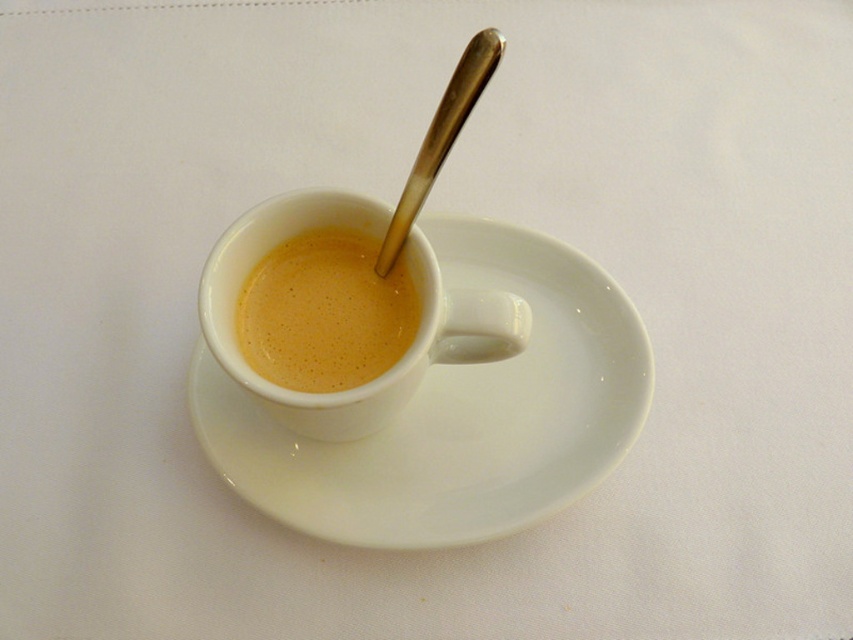
Question: From the image, what is the correct spatial relationship of white glossy saucer at center in relation to polished metal spoon at upper center?

Choices:
 (A) below
 (B) above

Answer: (A)

Question: Is white ceramic mug at center behind smooth cream cup at center?

Choices:
 (A) no
 (B) yes

Answer: (A)

Question: Which point appears farthest from the camera in this image?

Choices:
 (A) (415, 273)
 (B) (454, 120)
 (C) (303, 260)

Answer: (C)

Question: Which of the following is the farthest from the observer?

Choices:
 (A) (320, 432)
 (B) (432, 480)
 (C) (486, 81)
 (D) (277, 349)

Answer: (B)

Question: Which is nearer to the white glossy saucer at center?

Choices:
 (A) smooth cream cup at center
 (B) polished metal spoon at upper center
 (C) white ceramic mug at center

Answer: (C)

Question: Does white ceramic mug at center have a larger size compared to smooth cream cup at center?

Choices:
 (A) no
 (B) yes

Answer: (B)